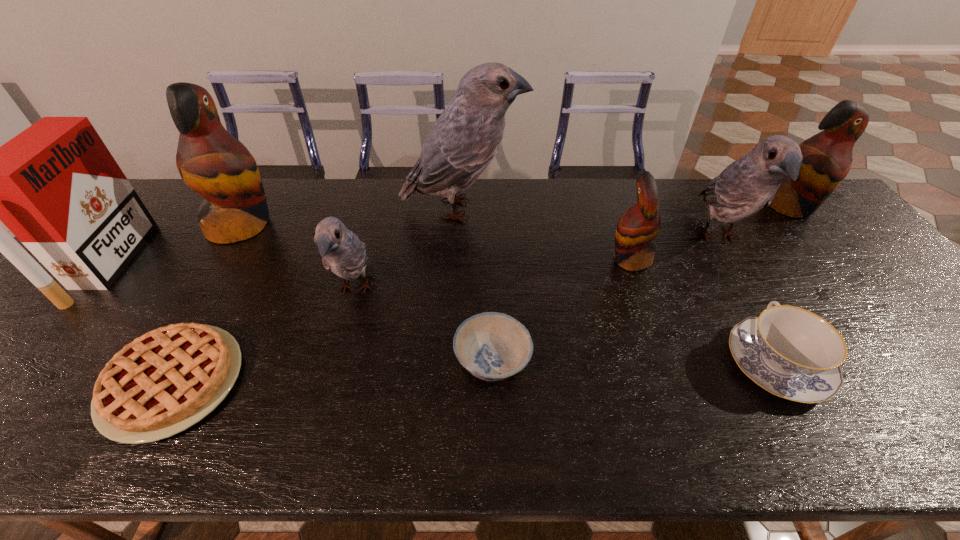
Where is `free space located 0.210m on the front-facing side of the biggest gray parrot`? free space located 0.210m on the front-facing side of the biggest gray parrot is located at coordinates (589, 209).

Where is `vacant space located on the face of the leftmost red parrot`? vacant space located on the face of the leftmost red parrot is located at coordinates (312, 226).

Image resolution: width=960 pixels, height=540 pixels. I want to click on vacant space located 0.280m on the face of the rightmost parrot, so click(x=857, y=291).

Locate an element on the screen. Image resolution: width=960 pixels, height=540 pixels. vacant space located on the front-facing side of the rightmost gray parrot is located at coordinates (780, 349).

This screenshot has height=540, width=960. I want to click on vacant space located on the front-facing side of the leftmost object, so click(x=171, y=264).

Where is `vacant space located 0.370m on the face of the fourth parrot from left to right`? The width and height of the screenshot is (960, 540). vacant space located 0.370m on the face of the fourth parrot from left to right is located at coordinates (477, 259).

You are a GUI agent. You are given a task and a screenshot of the screen. Output one action in this format:
    pyautogui.click(x=<x>, y=<y>)
    Task: Click on the vacant space positioned on the face of the fourth parrot from left to right
    
    Given the screenshot: What is the action you would take?
    pyautogui.click(x=513, y=259)

Image resolution: width=960 pixels, height=540 pixels. I want to click on vacant space situated on the face of the fourth parrot from left to right, so click(488, 259).

The height and width of the screenshot is (540, 960). Identify the location of vacant space situated 0.110m on the front-facing side of the fifth parrot from right to left. (336, 363).

This screenshot has width=960, height=540. I want to click on free space located 0.220m with the handle on the side of the blue chinaware, so click(x=720, y=261).